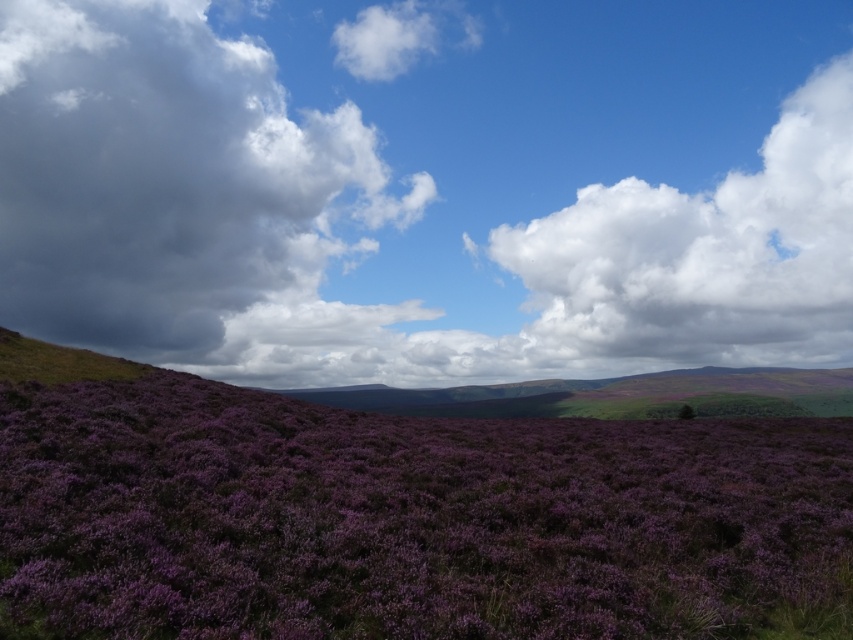
Question: Is purple soft-textured lavender at center to the left of white fluffy cloud at upper center from the viewer's perspective?

Choices:
 (A) no
 (B) yes

Answer: (A)

Question: Is the position of dark gray fluffy cloud at left more distant than that of white fluffy cloud at upper right?

Choices:
 (A) yes
 (B) no

Answer: (B)

Question: Is dark gray fluffy cloud at left above white fluffy cloud at upper center?

Choices:
 (A) no
 (B) yes

Answer: (A)

Question: Estimate the real-world distances between objects in this image. Which object is closer to the purple soft-textured lavender at center?

Choices:
 (A) white fluffy cloud at upper right
 (B) cloudy sky at upper center

Answer: (A)

Question: Which object appears closest to the camera in this image?

Choices:
 (A) cloudy sky at upper center
 (B) dark gray fluffy cloud at left
 (C) purple soft-textured lavender at center
 (D) white fluffy cloud at upper center

Answer: (C)

Question: Which object is the closest to the purple soft-textured lavender at center?

Choices:
 (A) white fluffy cloud at upper right
 (B) dark gray fluffy cloud at left
 (C) cloudy sky at upper center
 (D) white fluffy cloud at upper center

Answer: (A)